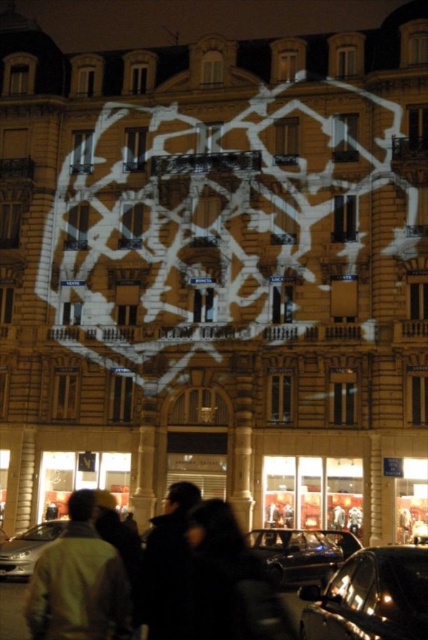
Question: Is light brown leather jacket at lower left above shiny black car at lower center?

Choices:
 (A) no
 (B) yes

Answer: (B)

Question: Which object is the farthest from the shiny silver car at lower left?

Choices:
 (A) light brown leather jacket at lower left
 (B) shiny black car at lower right

Answer: (B)

Question: Can you confirm if light brown leather jacket at lower left is thinner than shiny silver car at lower left?

Choices:
 (A) no
 (B) yes

Answer: (A)

Question: Does shiny black car at lower right appear under shiny silver car at lower left?

Choices:
 (A) yes
 (B) no

Answer: (B)

Question: Which of the following is the farthest from the observer?

Choices:
 (A) (11, 541)
 (B) (279, 547)
 (C) (47, 552)

Answer: (A)

Question: Which object is positioned farthest from the shiny black car at lower center?

Choices:
 (A) light brown leather jacket at lower left
 (B) shiny black car at lower right
 (C) shiny silver car at lower left

Answer: (A)